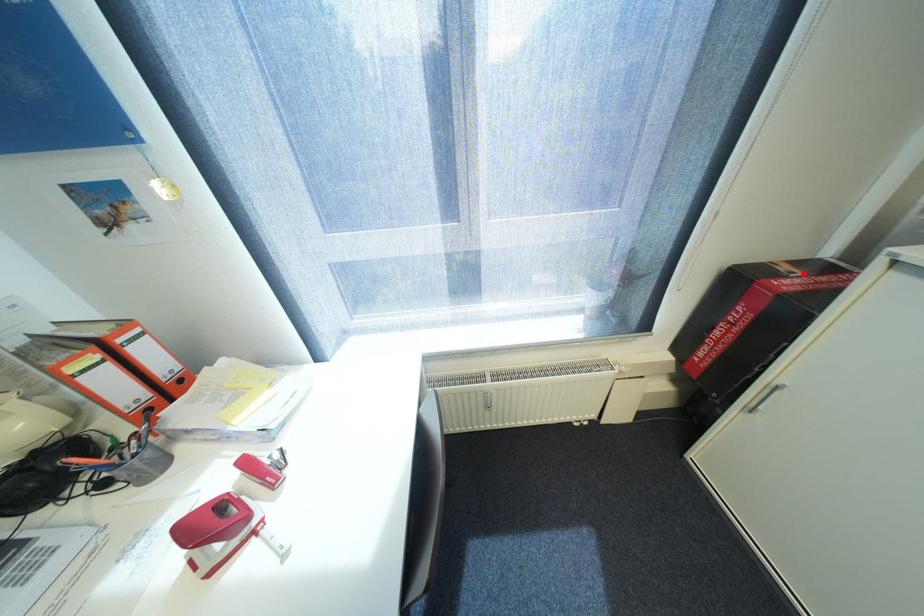
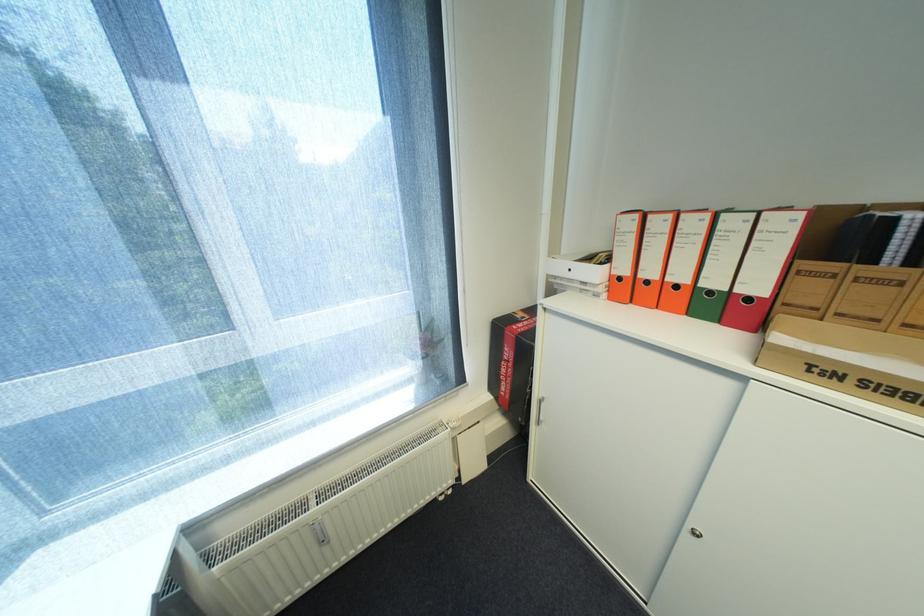
In the second image, find the point that corresponds to the highlighted location in the first image.

(532, 318)